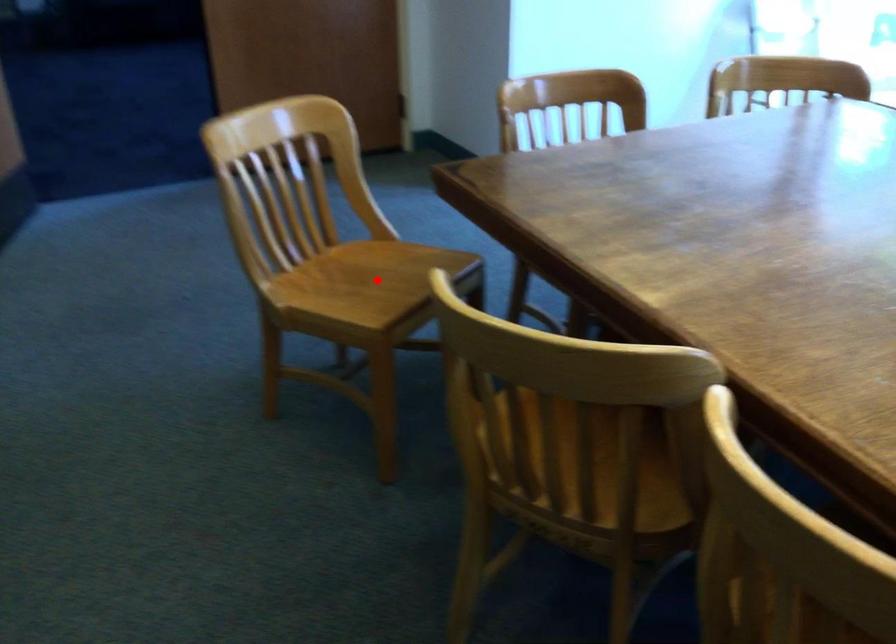
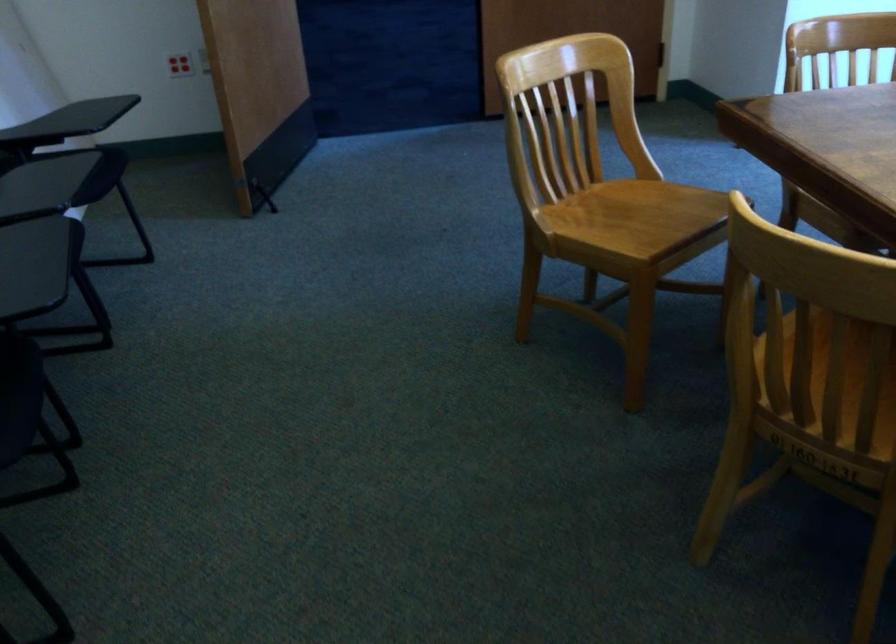
Locate, in the second image, the point that corresponds to the highlighted location in the first image.

(640, 216)